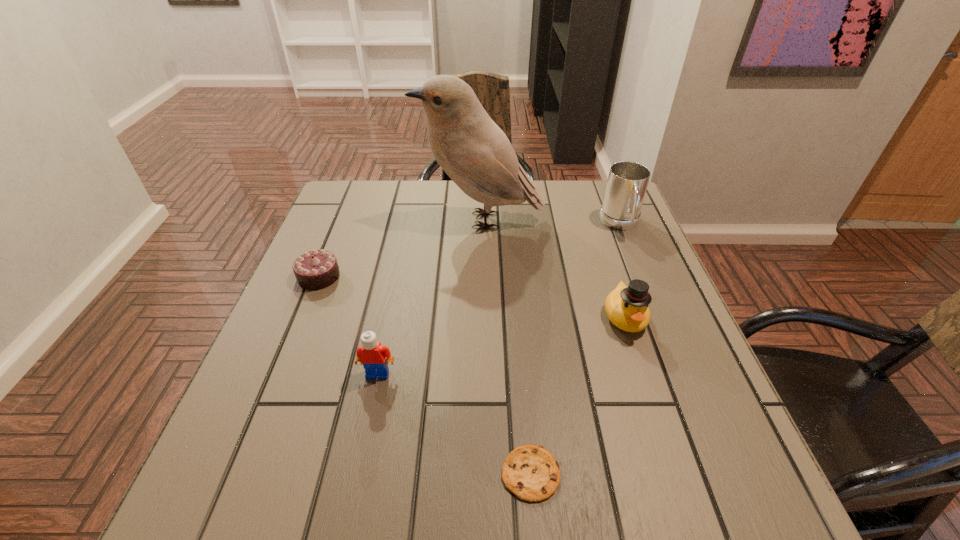
Locate an element on the screen. This screenshot has width=960, height=540. free space between the nearest object and the fourth nearest object is located at coordinates (425, 375).

Where is `free spot between the fourth farthest object and the leftmost object`? The image size is (960, 540). free spot between the fourth farthest object and the leftmost object is located at coordinates (471, 296).

Identify the location of vacant area between the third nearest object and the fifth farthest object. (501, 345).

Where is `unoccupied area between the parakeet and the fifth tallest object`? unoccupied area between the parakeet and the fifth tallest object is located at coordinates (399, 248).

At what (x,y) coordinates should I click in order to perform the action: click on blank region between the cookie and the third nearest object. Please return your answer as a coordinate pair (x, y). This screenshot has width=960, height=540. Looking at the image, I should click on (578, 395).

Where is `vacant area that lies between the chocolate cake and the duck`? The image size is (960, 540). vacant area that lies between the chocolate cake and the duck is located at coordinates (471, 296).

Locate an element on the screen. free space between the fifth farthest object and the duck is located at coordinates (501, 345).

The height and width of the screenshot is (540, 960). I want to click on vacant space that is in between the second tallest object and the fourth farthest object, so click(x=622, y=271).

Point out which object is positioned as the fourth nearest to the mug. Please provide its 2D coordinates. Your answer should be formatted as a tuple, i.e. [(x, y)], where the tuple contains the x and y coordinates of a point satisfying the conditions above.

[(374, 357)]

Locate which object ranks fourth in proximity to the mug. Please provide its 2D coordinates. Your answer should be formatted as a tuple, i.e. [(x, y)], where the tuple contains the x and y coordinates of a point satisfying the conditions above.

[(374, 357)]